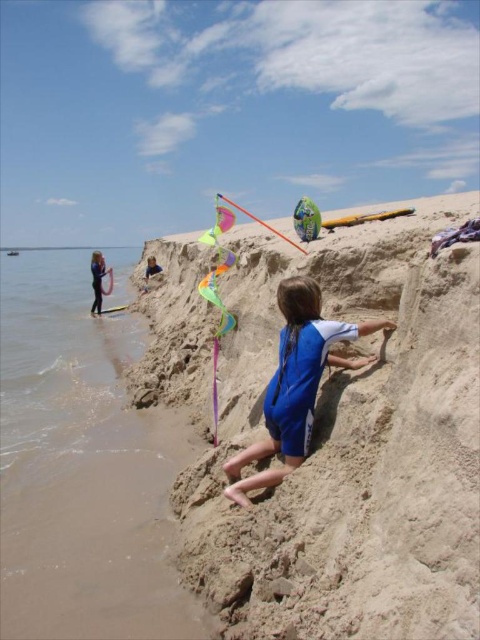
Question: Does brown sand at lower left come behind blue fabric child at center?

Choices:
 (A) no
 (B) yes

Answer: (A)

Question: Where is smooth sandcastle at center located in relation to blue fabric child at center in the image?

Choices:
 (A) left
 (B) right

Answer: (A)

Question: Which object is farther from the camera taking this photo?

Choices:
 (A) smooth sandcastle at center
 (B) blue swimsuit at left
 (C) brown sand at lower left
 (D) blue fabric child at center

Answer: (B)

Question: Which point is farther to the camera?

Choices:
 (A) brown sand at lower left
 (B) smooth sandcastle at center

Answer: (A)

Question: Estimate the real-world distances between objects in this image. Which object is farther from the blue fabric child at center?

Choices:
 (A) smooth sandcastle at center
 (B) brown sand at lower left

Answer: (B)

Question: Is smooth sandcastle at center smaller than blue swimsuit at left?

Choices:
 (A) no
 (B) yes

Answer: (B)